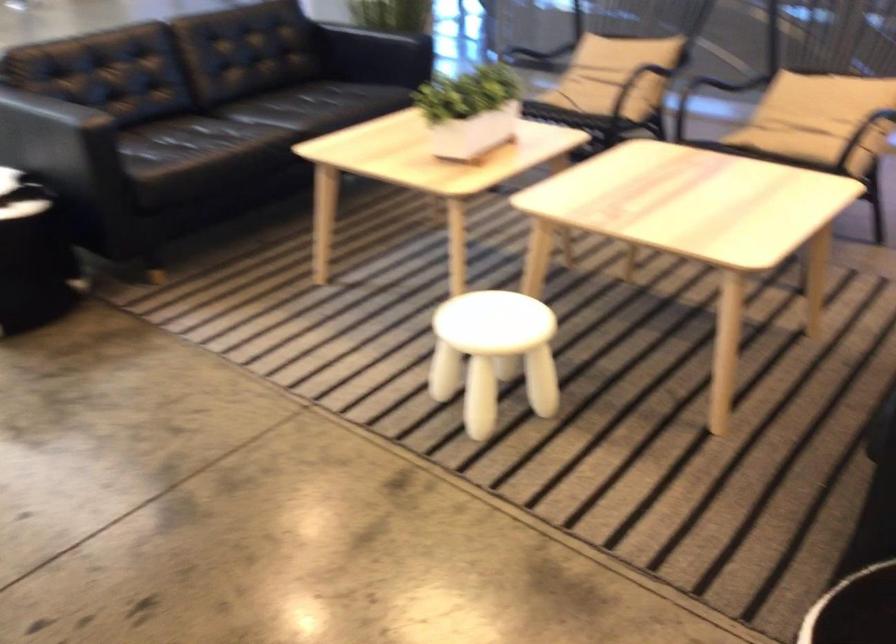
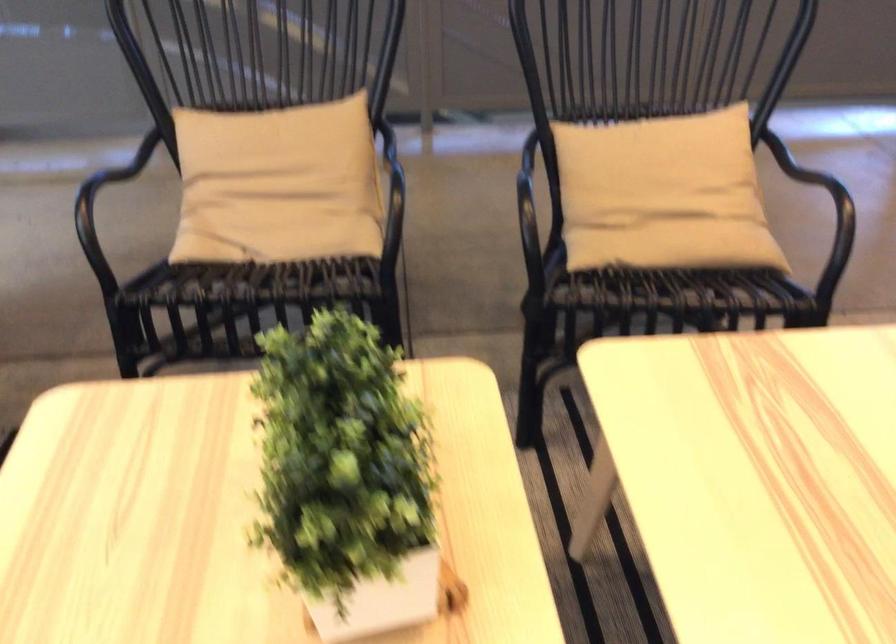
Find the pixel in the second image that matches (x=591, y=67) in the first image.

(278, 184)